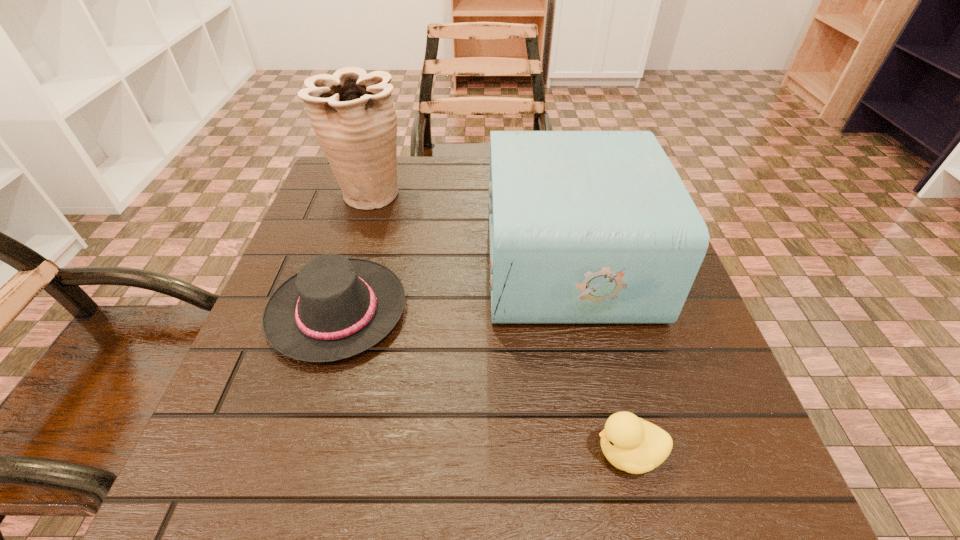
Image resolution: width=960 pixels, height=540 pixels. I want to click on urn, so click(x=352, y=113).

The width and height of the screenshot is (960, 540). In order to click on radio receiver in this screenshot , I will do `click(585, 226)`.

Identify the location of dress hat. (335, 307).

Image resolution: width=960 pixels, height=540 pixels. I want to click on duck, so click(x=632, y=444).

Identify the location of free space located on the front of the urn. (337, 299).

Locate an element on the screen. This screenshot has width=960, height=540. blank space located on the front panel of the third shortest object is located at coordinates (424, 261).

You are a GUI agent. You are given a task and a screenshot of the screen. Output one action in this format:
    pyautogui.click(x=<x>, y=<y>)
    Task: Click on the free space located 0.110m on the front panel of the third shortest object
    This screenshot has height=540, width=960.
    Given the screenshot: What is the action you would take?
    pyautogui.click(x=434, y=261)

Locate an element on the screen. The height and width of the screenshot is (540, 960). free space located on the front panel of the third shortest object is located at coordinates (365, 261).

Image resolution: width=960 pixels, height=540 pixels. In order to click on free space located on the front of the dress hat in this screenshot , I will do `click(303, 427)`.

Image resolution: width=960 pixels, height=540 pixels. Find the location of `free point located on the front-facing side of the nearest object`. free point located on the front-facing side of the nearest object is located at coordinates (550, 453).